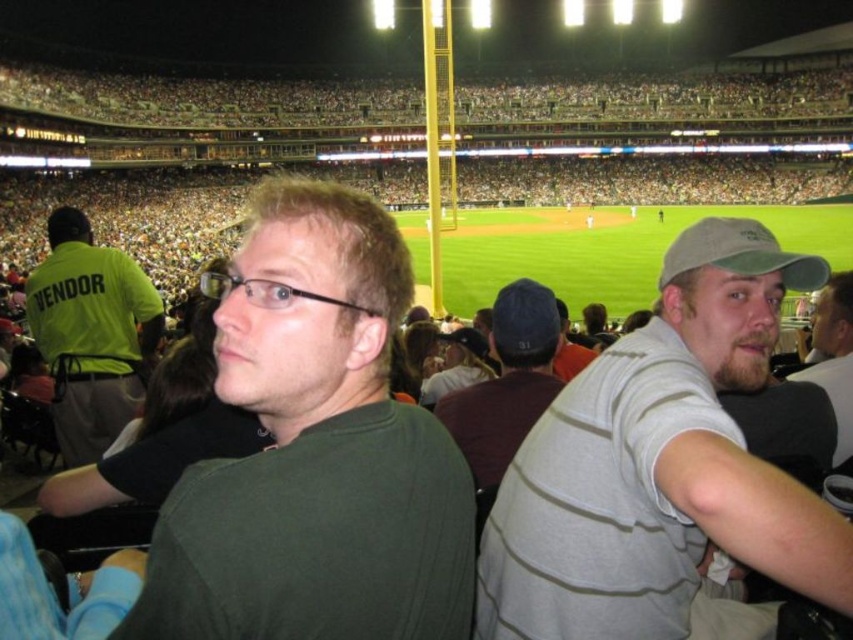
Question: Observing the image, what is the correct spatial positioning of green matte shirt at center in reference to khaki fabric cap at right?

Choices:
 (A) right
 (B) left

Answer: (B)

Question: Based on their relative distances, which object is nearer to the green matte shirt at center?

Choices:
 (A) beige fabric cap at right
 (B) gray striped shirt at right
 (C) dark blue cap at center
 (D) neon green shirt at left

Answer: (B)

Question: Does khaki fabric cap at right appear on the right side of beige fabric cap at right?

Choices:
 (A) no
 (B) yes

Answer: (A)

Question: Which object is positioned farthest from the green matte shirt at center?

Choices:
 (A) beige fabric cap at right
 (B) gray striped shirt at right
 (C) dark blue cap at center

Answer: (A)

Question: Which point is farther from the camera taking this photo?

Choices:
 (A) pyautogui.click(x=555, y=609)
 (B) pyautogui.click(x=78, y=216)
 (C) pyautogui.click(x=381, y=508)

Answer: (B)

Question: Is gray striped shirt at right positioned in front of neon green shirt at left?

Choices:
 (A) no
 (B) yes

Answer: (B)